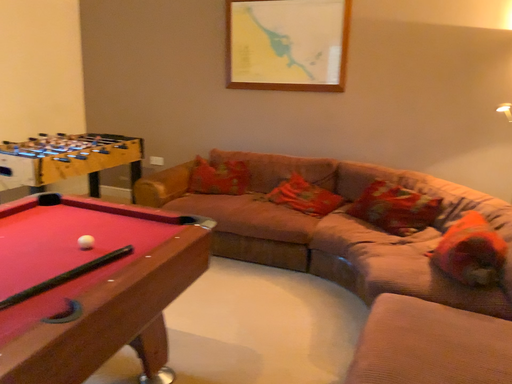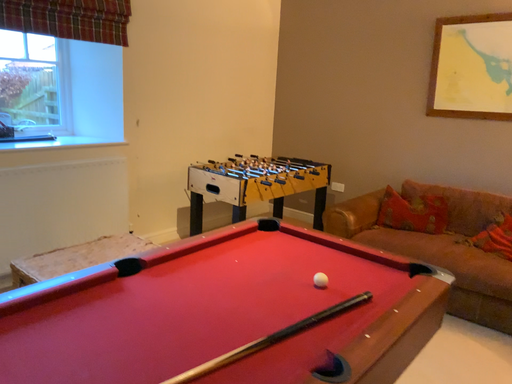
Question: Which way did the camera rotate in the video?

Choices:
 (A) rotated left
 (B) rotated right

Answer: (A)